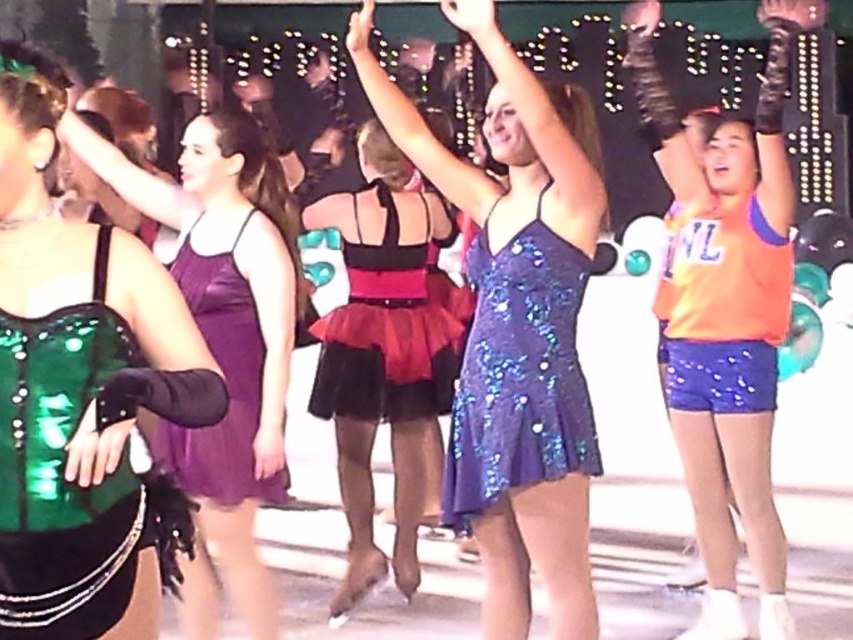
Which is above, green shiny corset at left or shiny black dress at center?

shiny black dress at center

Which of these two, green shiny corset at left or shiny black dress at center, stands shorter?

shiny black dress at center

What are the coordinates of `green shiny corset at left` in the screenshot? It's located at [76, 388].

The image size is (853, 640). I want to click on green shiny corset at left, so click(x=76, y=388).

In the scene shown: Which is more to the right, green shiny corset at left or sequined fabric tutu at center?

sequined fabric tutu at center

Can you confirm if green shiny corset at left is smaller than sequined fabric tutu at center?

Correct, green shiny corset at left occupies less space than sequined fabric tutu at center.

Where is `green shiny corset at left`? Image resolution: width=853 pixels, height=640 pixels. green shiny corset at left is located at coordinates (76, 388).

From the picture: Which of these two, shiny blue dress at center or shiny black dress at center, stands shorter?

Standing shorter between the two is shiny blue dress at center.

Measure the distance between shiny blue dress at center and camera.

shiny blue dress at center and camera are 10.22 feet apart from each other.

This screenshot has width=853, height=640. I want to click on shiny blue dress at center, so tap(492, 140).

Locate an element on the screen. The height and width of the screenshot is (640, 853). shiny blue dress at center is located at coordinates (492, 140).